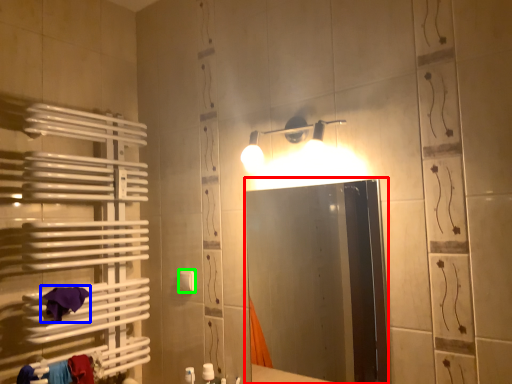
Question: Which object is the farthest from mirror (highlighted by a red box)? Choose among these: bath towel (highlighted by a blue box) or towel bar (highlighted by a green box).

Choices:
 (A) bath towel
 (B) towel bar

Answer: (A)